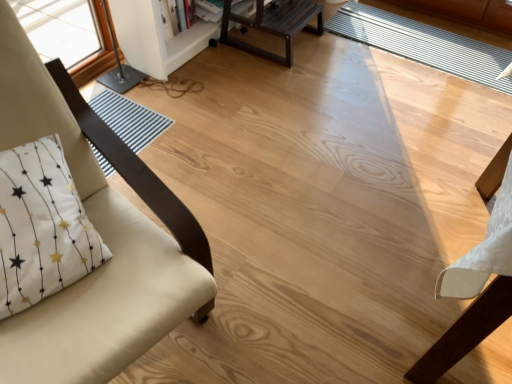
Locate an element on the screen. This screenshot has width=512, height=384. vacant space in white striped mat at center (from a real-world perspective) is located at coordinates (425, 51).